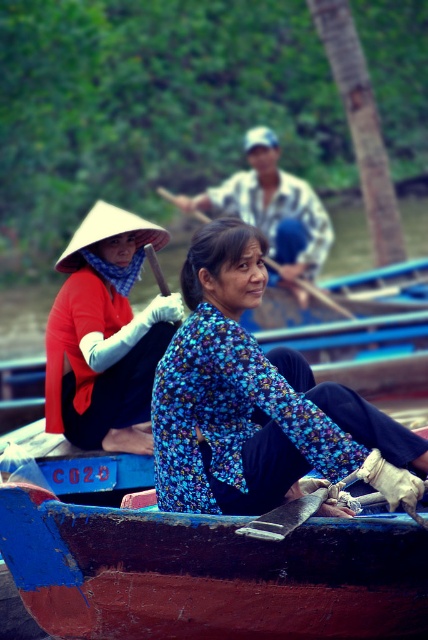
Question: Is rusty wood canoe at lower center wider than wooden smooth paddle at center?

Choices:
 (A) no
 (B) yes

Answer: (B)

Question: Among these objects, which one is nearest to the camera?

Choices:
 (A) wooden smooth paddle at center
 (B) wooden paddle at center
 (C) floral fabric woman at center
 (D) matte red blouse at upper left

Answer: (A)

Question: Estimate the real-world distances between objects in this image. Which object is closer to the rusty wood canoe at lower center?

Choices:
 (A) floral fabric woman at center
 (B) floral fabric shirt at center
 (C) matte red blouse at upper left

Answer: (B)

Question: Is floral fabric woman at center positioned behind wooden paddle at center?

Choices:
 (A) yes
 (B) no

Answer: (B)

Question: Is rusty wood canoe at lower center bigger than floral fabric woman at center?

Choices:
 (A) no
 (B) yes

Answer: (A)

Question: Which object appears farthest from the camera in this image?

Choices:
 (A) floral fabric woman at center
 (B) rusty wood canoe at lower center

Answer: (A)